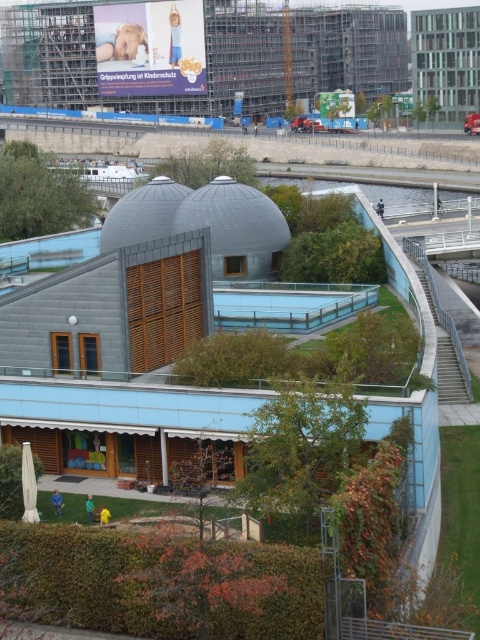
Question: Is brown textured hedge at lower center in front of green leafy hedge at upper center?

Choices:
 (A) no
 (B) yes

Answer: (B)

Question: Among these points, which one is farthest from the camera?

Choices:
 (A) (216, 173)
 (B) (20, 484)
 (C) (224, 620)

Answer: (A)

Question: Estimate the real-world distances between objects in this image. Which object is closer to the green leafy hedge at upper center?

Choices:
 (A) green matte hedge at lower left
 (B) brown textured hedge at lower center
 (C) green leafy hedge at center
 (D) green leafy hedge at left

Answer: (D)

Question: Can you confirm if brown textured hedge at lower center is positioned above green leafy hedge at upper center?

Choices:
 (A) no
 (B) yes

Answer: (A)

Question: Which object is positioned closest to the green leafy hedge at upper center?

Choices:
 (A) green leafy hedge at center
 (B) brown textured hedge at lower center

Answer: (A)

Question: Where is green leafy hedge at left located in relation to green leafy hedge at center in the image?

Choices:
 (A) left
 (B) right

Answer: (A)